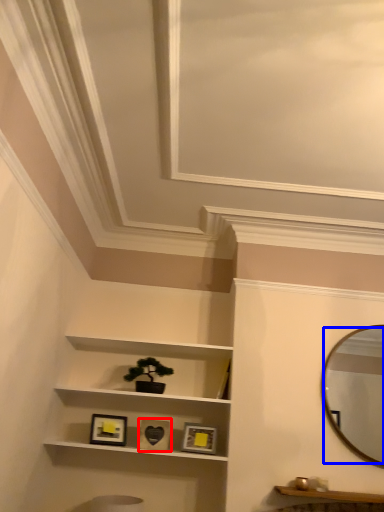
Question: Which object appears closest to the camera in this image, picture frame (highlighted by a red box) or mirror (highlighted by a blue box)?

Choices:
 (A) picture frame
 (B) mirror

Answer: (B)